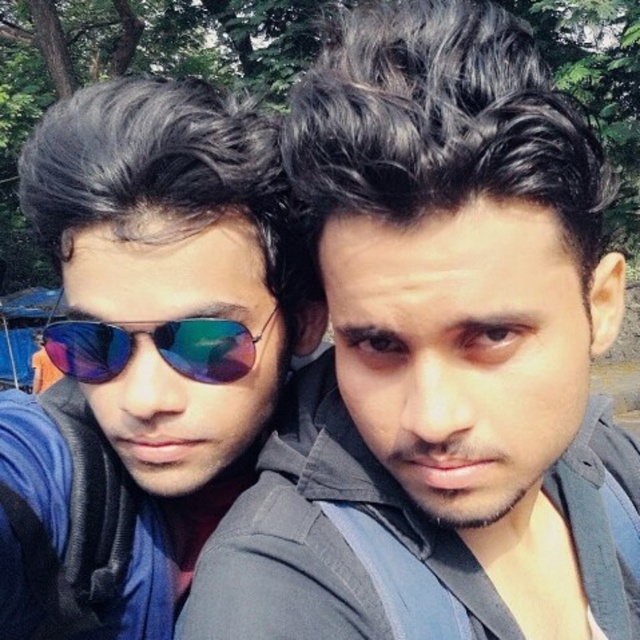
Question: Estimate the real-world distances between objects in this image. Which object is closer to the shiny reflective sunglasses at center?

Choices:
 (A) matte black sunglasses at left
 (B) dark gray hair at center

Answer: (A)

Question: Can you confirm if dark gray hair at center is positioned to the left of matte black sunglasses at left?

Choices:
 (A) no
 (B) yes

Answer: (A)

Question: Does dark gray hair at center have a lesser width compared to shiny reflective sunglasses at center?

Choices:
 (A) no
 (B) yes

Answer: (A)

Question: Can you confirm if dark gray hair at center is positioned above matte black sunglasses at left?

Choices:
 (A) yes
 (B) no

Answer: (A)

Question: Which of the following is the closest to the observer?

Choices:
 (A) matte black sunglasses at left
 (B) dark gray hair at center

Answer: (B)

Question: Which point is closer to the camera?

Choices:
 (A) (76, 410)
 (B) (477, 65)

Answer: (B)